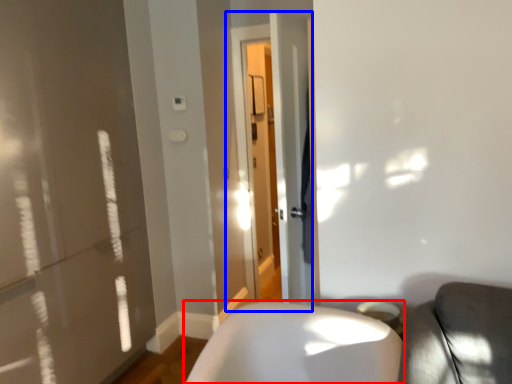
Question: Which of the following is the closest to the observer, furniture (highlighted by a red box) or screen door (highlighted by a blue box)?

Choices:
 (A) furniture
 (B) screen door

Answer: (A)